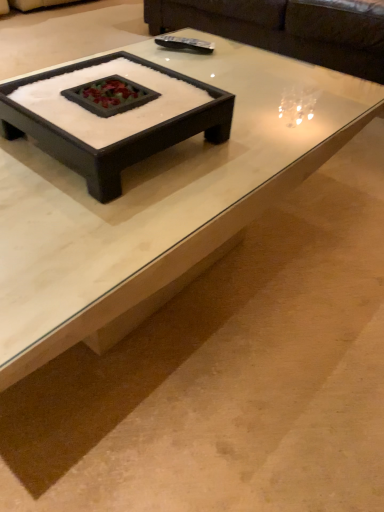
This screenshot has width=384, height=512. Find the location of `free location to the right of black matte tray at center, placed as the 1th coffee table when sorted from back to front`. free location to the right of black matte tray at center, placed as the 1th coffee table when sorted from back to front is located at coordinates (257, 137).